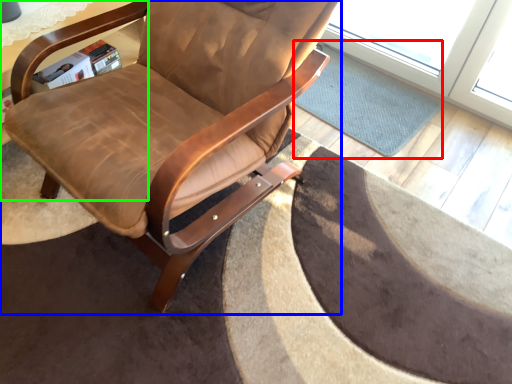
Question: Which is farther away from mat (highlighted by a red box)? chair (highlighted by a blue box) or table (highlighted by a green box)?

Choices:
 (A) chair
 (B) table

Answer: (B)